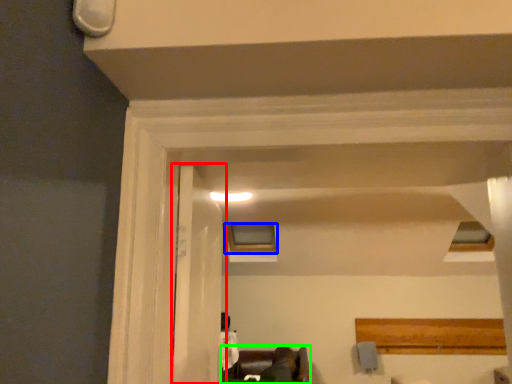
Question: Which object is the closest to the door (highlighted by a red box)? Choose among these: window (highlighted by a blue box) or furniture (highlighted by a green box).

Choices:
 (A) window
 (B) furniture

Answer: (B)